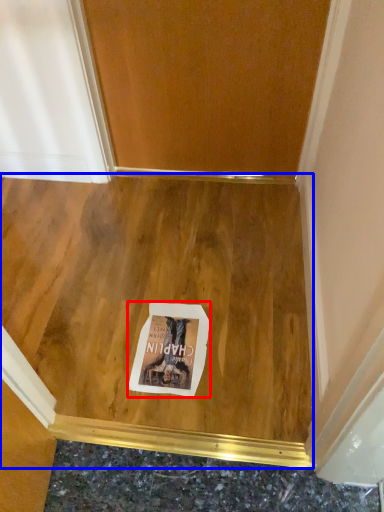
Question: Which point is closer to the camera, postcard (highlighted by a red box) or plywood (highlighted by a blue box)?

Choices:
 (A) postcard
 (B) plywood

Answer: (B)